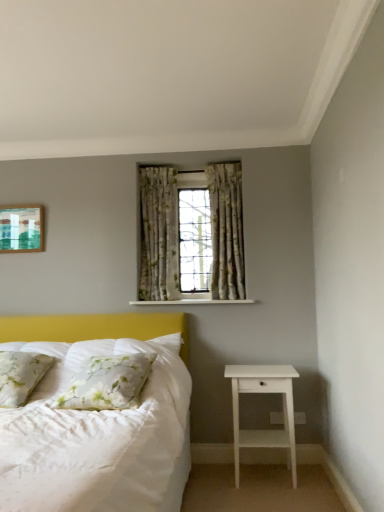
You are a GUI agent. You are given a task and a screenshot of the screen. Output one action in this format:
    pyautogui.click(x=<x>, y=<y>)
    Task: Click on the vacant space situated above green floral fabric curtain at center, the 2th curtain positioned from the right (from a real-world perspective)
    
    Given the screenshot: What is the action you would take?
    pyautogui.click(x=167, y=164)